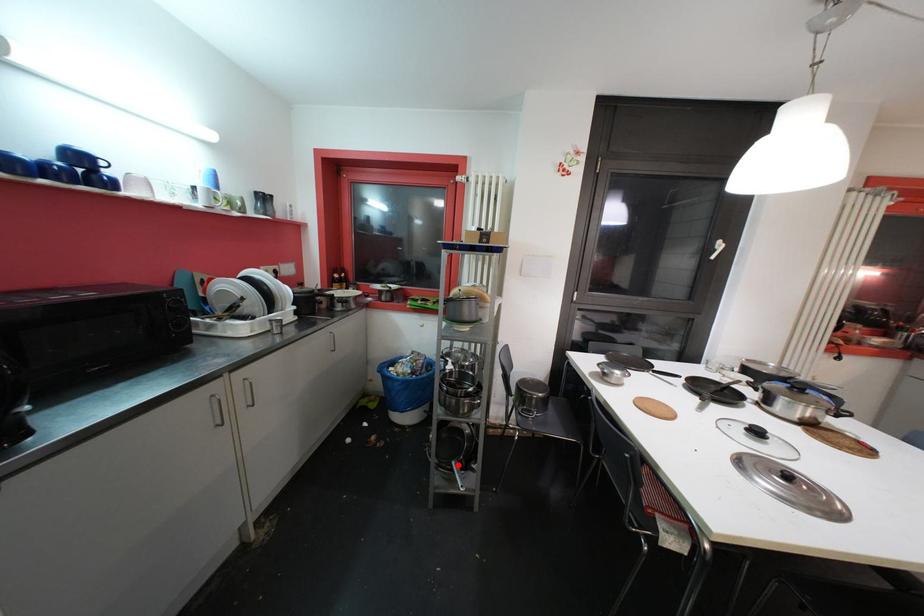
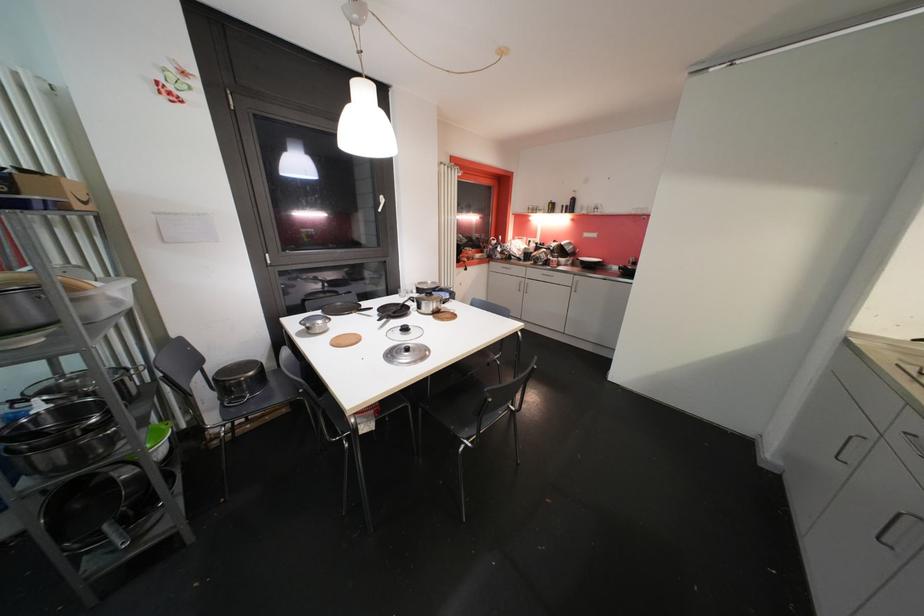
Find the pixel in the second image that matches the highlighted location in the first image.

(111, 529)